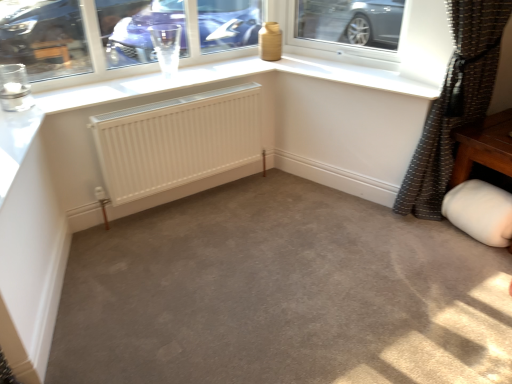
The height and width of the screenshot is (384, 512). What do you see at coordinates (480, 212) in the screenshot?
I see `white matte jar at lower right` at bounding box center [480, 212].

Measure the distance between transparent glass at upper center and camera.

transparent glass at upper center and camera are 7.34 feet apart from each other.

Image resolution: width=512 pixels, height=384 pixels. I want to click on white matte radiator at center, so click(x=177, y=141).

The width and height of the screenshot is (512, 384). Find the location of `white matte jar at lower right`. white matte jar at lower right is located at coordinates (480, 212).

Is point (488, 54) closer to viewer compared to point (478, 235)?

Yes, it is in front of point (478, 235).

Can you confirm if brown textured curtain at right is taller than white matte jar at lower right?

Yes, brown textured curtain at right is taller than white matte jar at lower right.

How distant is brown textured curtain at right from white matte jar at lower right?

brown textured curtain at right is 34.06 centimeters away from white matte jar at lower right.

Which of these two, transparent glass at upper center or white matte jar at lower right, stands shorter?

With less height is white matte jar at lower right.

From the image's perspective, is transparent glass at upper center on white matte jar at lower right?

Yes, from the image's perspective, transparent glass at upper center is above white matte jar at lower right.

Is transparent glass at upper center next to white matte jar at lower right?

There is a gap between transparent glass at upper center and white matte jar at lower right.

Does point (298, 45) appear closer or farther from the camera than point (473, 221)?

Point (298, 45) appears to be farther away from the viewer than point (473, 221).

Considering the sizes of objects white matte radiator at center and transparent glass at upper center in the image provided, who is bigger, white matte radiator at center or transparent glass at upper center?

white matte radiator at center is bigger.

Is white matte radiator at center shorter than transparent glass at upper center?

In fact, white matte radiator at center may be taller than transparent glass at upper center.

From a real-world perspective, which object stands above the other?

In real-world perspective, transparent glass at upper center is above.

In the scene shown: Is transparent glass at upper center a part of white matte radiator at center?

That's incorrect, transparent glass at upper center is not inside white matte radiator at center.

Between transparent glass at upper center and white matte radiator at center, which one appears on the right side from the viewer's perspective?

white matte radiator at center is more to the right.

Does point (195, 19) come behind point (96, 131)?

Yes, it is.

Are transparent glass at upper center and white matte radiator at center far apart?

No, transparent glass at upper center is not far away from white matte radiator at center.

Would you say white matte jar at lower right is outside white matte radiator at center?

white matte jar at lower right lies outside white matte radiator at center's area.

Is white matte jar at lower right not near white matte radiator at center?

Absolutely, white matte jar at lower right is distant from white matte radiator at center.

Is white matte jar at lower right bigger than white matte radiator at center?

No.

Between brown textured curtain at right and transparent glass at upper center, which one appears on the right side from the viewer's perspective?

Positioned to the right is brown textured curtain at right.

From the image's perspective, which object appears higher, brown textured curtain at right or transparent glass at upper center?

transparent glass at upper center appears higher in the image.

Is brown textured curtain at right not near transparent glass at upper center?

No, brown textured curtain at right is in close proximity to transparent glass at upper center.

Which object is closer to the camera taking this photo, brown textured curtain at right or transparent glass at upper center?

brown textured curtain at right.

Is white matte jar at lower right in front of or behind transparent glass at upper center in the image?

Visually, white matte jar at lower right is located behind transparent glass at upper center.

Is white matte jar at lower right facing towards transparent glass at upper center?

No, white matte jar at lower right does not turn towards transparent glass at upper center.

Considering the relative positions of white matte jar at lower right and transparent glass at upper center in the image provided, is white matte jar at lower right to the left or to the right of transparent glass at upper center?

From the image, it's evident that white matte jar at lower right is to the right of transparent glass at upper center.

Where is `window on the left side of white matte jar at lower right`? The image size is (512, 384). window on the left side of white matte jar at lower right is located at coordinates (326, 42).

At what (x,y) coordinates should I click in order to perform the action: click on curtain on the left of white matte jar at lower right. Please return your answer as a coordinate pair (x, y). Looking at the image, I should click on 455,103.

The image size is (512, 384). In the image, there is a transparent glass at upper center. What are the coordinates of `gray below it (from the image's perspective)` in the screenshot? It's located at (480, 212).

Based on their spatial positions, is white matte jar at lower right or white matte radiator at center further from brown textured curtain at right?

white matte radiator at center lies further to brown textured curtain at right than the other object.

Looking at the image, which one is located closer to transparent glass at upper center, brown textured curtain at right or white matte radiator at center?

The object closer to transparent glass at upper center is white matte radiator at center.

Estimate the real-world distances between objects in this image. Which object is further from transparent glass at upper center, brown textured curtain at right or white matte jar at lower right?

Based on the image, white matte jar at lower right appears to be further to transparent glass at upper center.

Considering their positions, is transparent glass at upper center positioned closer to white matte jar at lower right than brown textured curtain at right?

brown textured curtain at right is closer to white matte jar at lower right.

Based on their spatial positions, is transparent glass at upper center or brown textured curtain at right closer to white matte radiator at center?

The object closer to white matte radiator at center is transparent glass at upper center.

Considering their positions, is brown textured curtain at right positioned closer to white matte radiator at center than transparent glass at upper center?

transparent glass at upper center is positioned closer to the anchor white matte radiator at center.

From the image, which object appears to be farther from transparent glass at upper center, white matte jar at lower right or brown textured curtain at right?

Based on the image, white matte jar at lower right appears to be further to transparent glass at upper center.

Estimate the real-world distances between objects in this image. Which object is further from brown textured curtain at right, white matte radiator at center or transparent glass at upper center?

Among the two, white matte radiator at center is located further to brown textured curtain at right.

Locate an element on the screen. The image size is (512, 384). radiator situated between transparent glass at upper center and white matte jar at lower right from left to right is located at coordinates (177, 141).

Locate an element on the screen. This screenshot has height=384, width=512. curtain between transparent glass at upper center and white matte jar at lower right from left to right is located at coordinates (455, 103).

This screenshot has height=384, width=512. What are the coordinates of `radiator located between transparent glass at upper center and brown textured curtain at right in the left-right direction` in the screenshot? It's located at (177, 141).

Find the location of a particular element. Image resolution: width=512 pixels, height=384 pixels. curtain between white matte radiator at center and white matte jar at lower right is located at coordinates (455, 103).